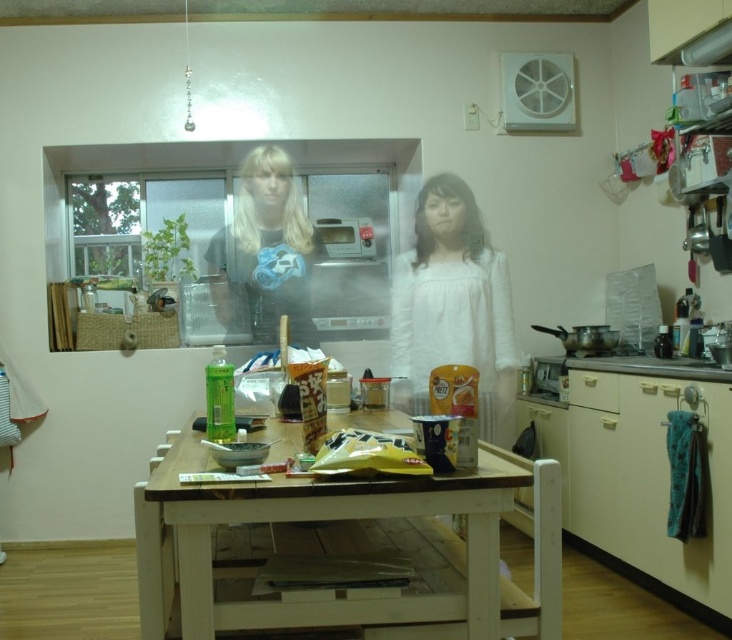
Does wooden table at center have a greater height compared to blonde hair at center?

In fact, wooden table at center may be shorter than blonde hair at center.

Measure the distance from wooden table at center to blonde hair at center.

wooden table at center is 1.88 meters from blonde hair at center.

Between point (408, 502) and point (307, 246), which one is positioned behind?

Point (307, 246)

I want to click on wooden table at center, so click(x=343, y=550).

Does white cotton shirt at center appear on the right side of blonde hair at center?

Correct, you'll find white cotton shirt at center to the right of blonde hair at center.

Who is more distant from viewer, (479,330) or (255,179)?

Point (255,179)

At what (x,y) coordinates should I click in order to perform the action: click on white cotton shirt at center. Please return your answer as a coordinate pair (x, y). The image size is (732, 640). Looking at the image, I should click on (452, 305).

Is wooden table at center below white cotton shirt at center?

Correct, wooden table at center is located below white cotton shirt at center.

Does point (448, 589) lie behind point (425, 408)?

No, it is in front of (425, 408).

This screenshot has width=732, height=640. Identify the location of wooden table at center. (343, 550).